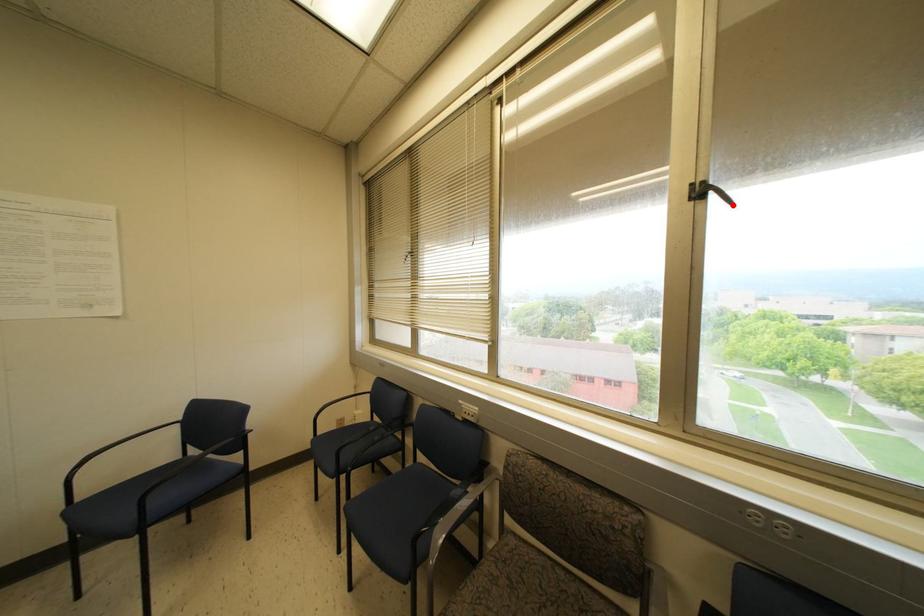
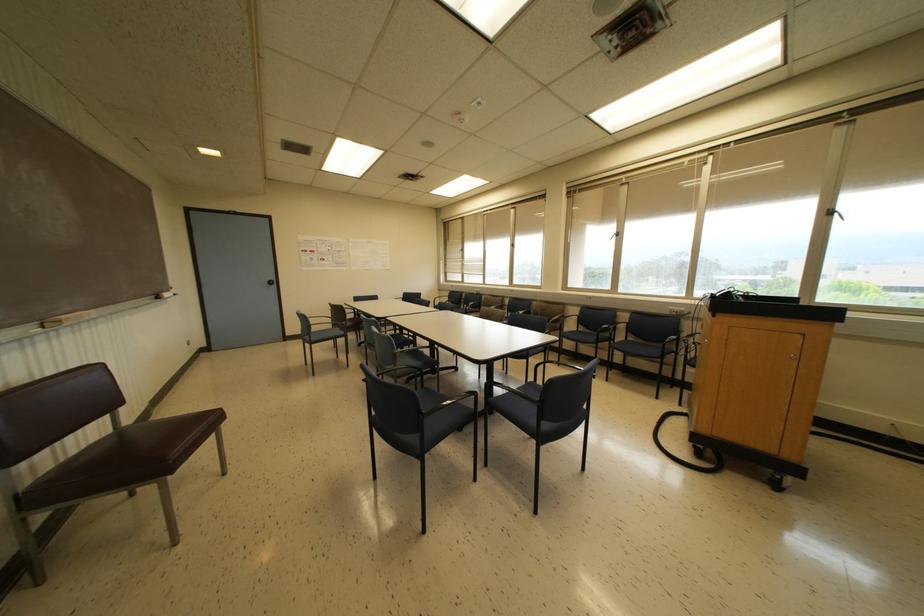
Question: I am providing you with two images of the same scene from different viewpoints. A red point is marked on the first image. Is the red point's position out of view in image 2?

Choices:
 (A) Yes
 (B) No

Answer: (A)